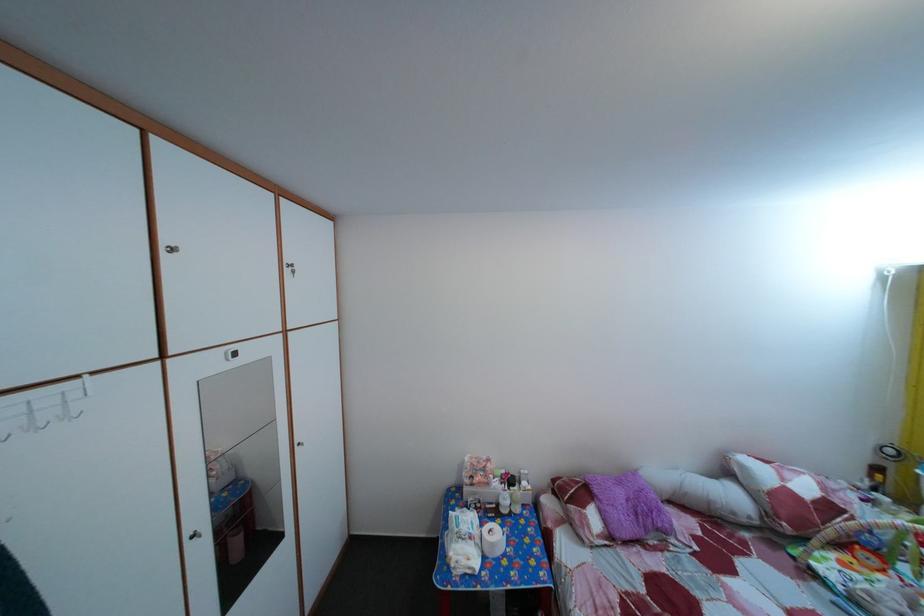
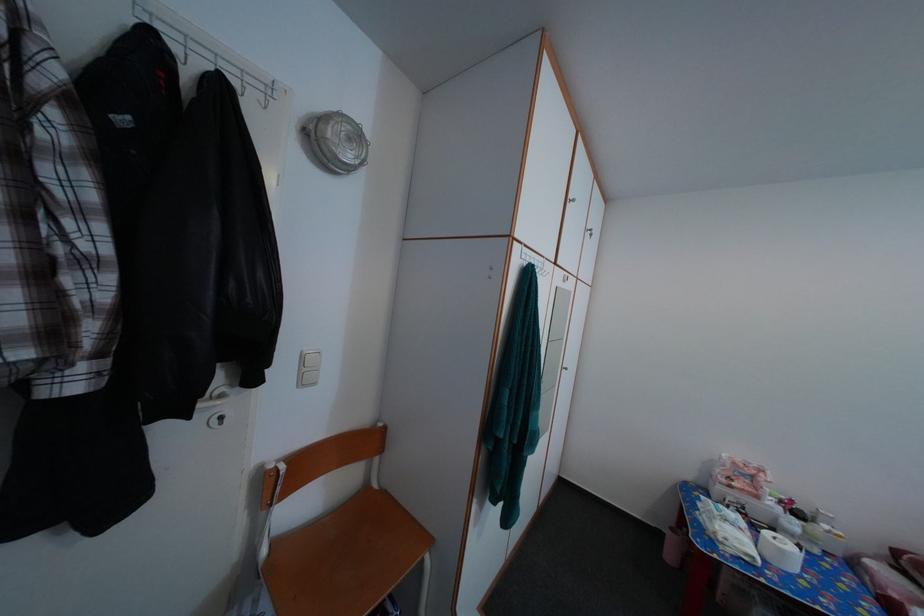
Question: The camera is either moving clockwise (left) or counter-clockwise (right) around the object. The first image is from the beginning of the video and the second image is from the end. Is the camera moving left or right when shooting the video?

Choices:
 (A) Left
 (B) Right

Answer: (B)